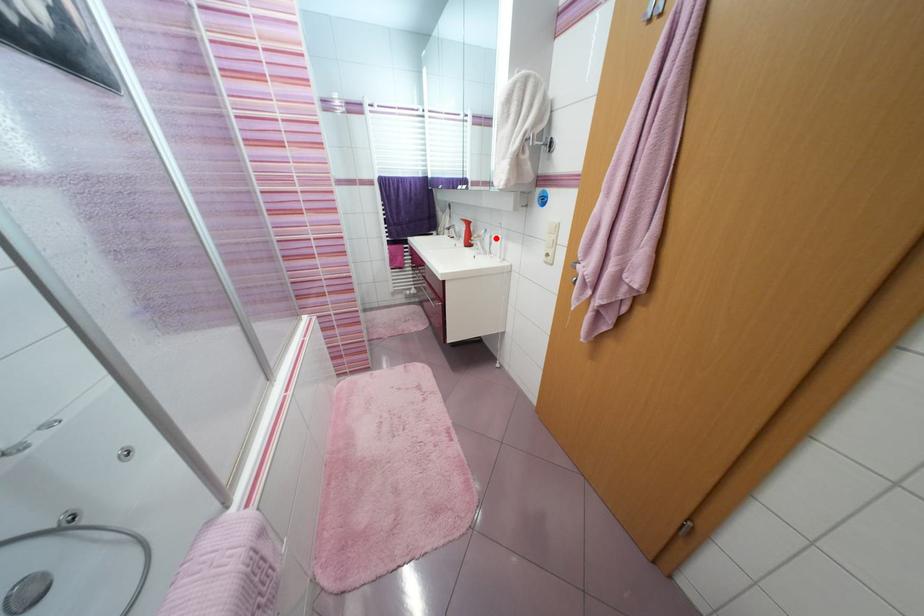
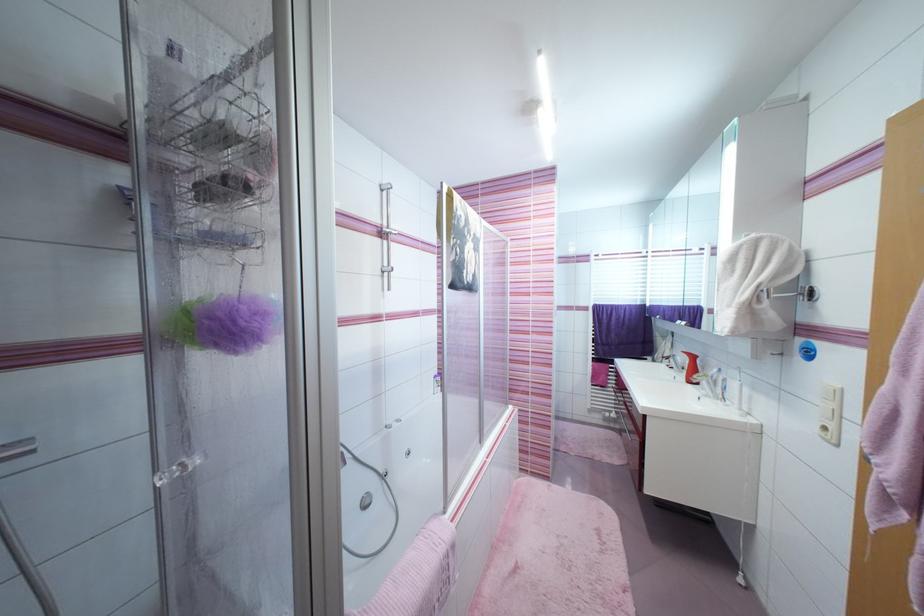
Question: I am providing you with two images of the same scene from different viewpoints. A red point is marked on the first image. Is the red point's position out of view in image 2?

Choices:
 (A) Yes
 (B) No

Answer: (B)